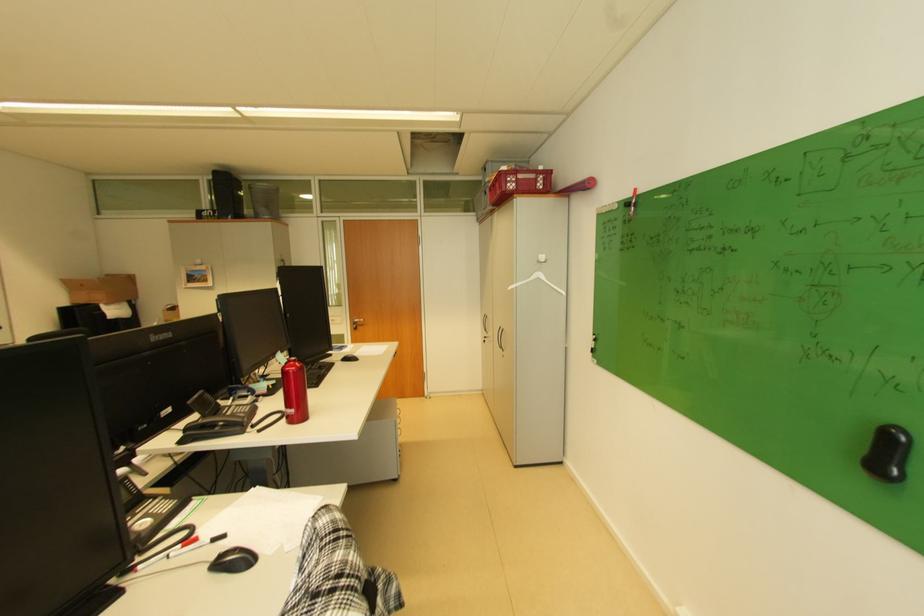
Where would you lift the grey mesh trashcan? Please return your answer as a coordinate pair (x, y).

(263, 199)